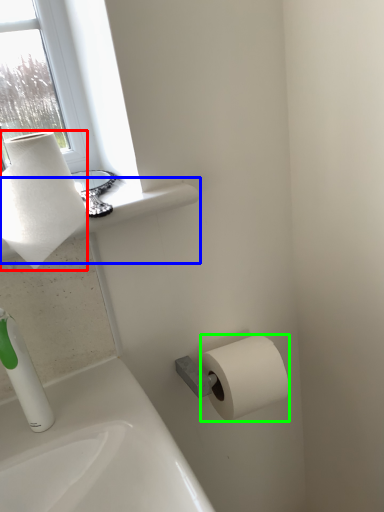
Question: Estimate the real-world distances between objects in this image. Which object is closer to paper towel (highlighted by a red box), window sill (highlighted by a blue box) or toilet paper (highlighted by a green box)?

Choices:
 (A) window sill
 (B) toilet paper

Answer: (A)